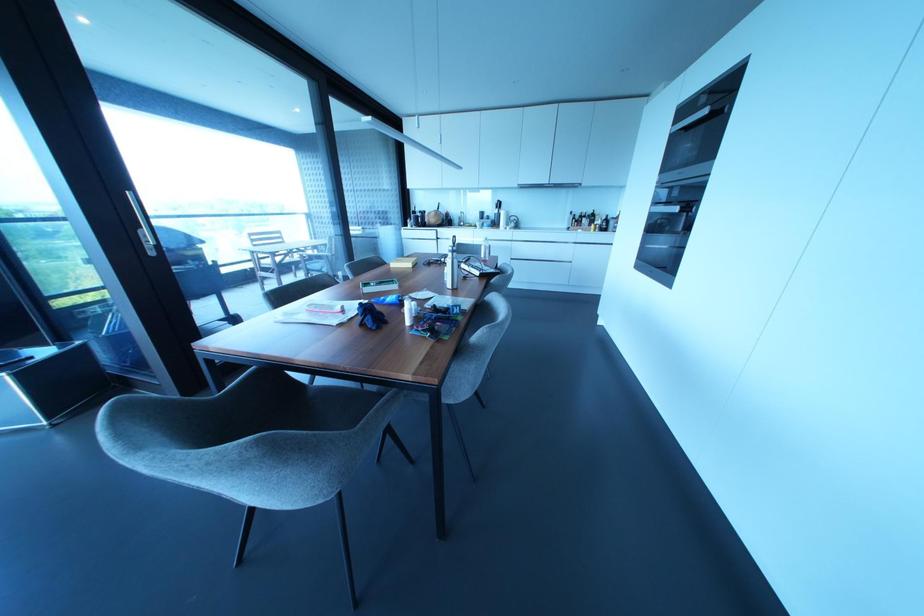
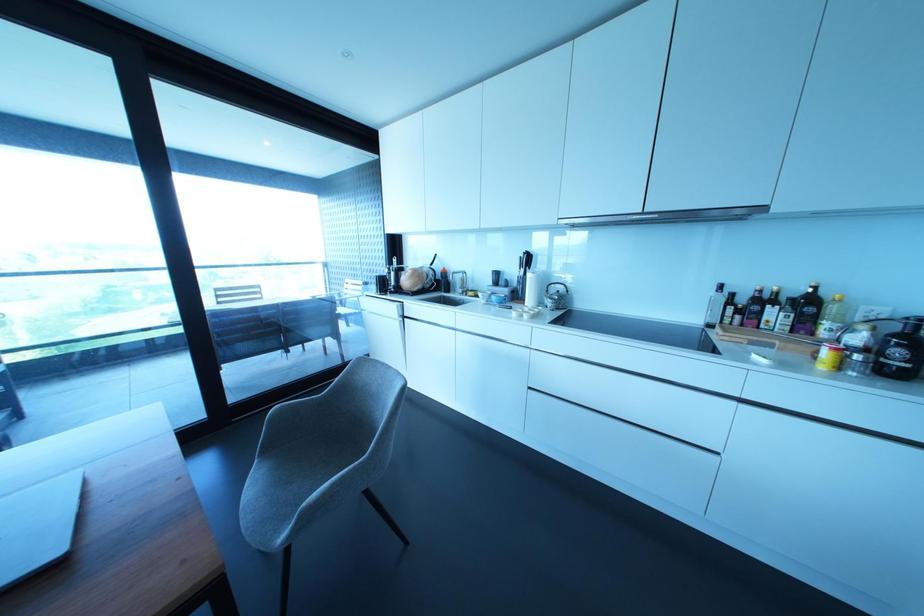
Where in the second image is the point corresponding to pixel 512 224 from the first image?

(549, 302)